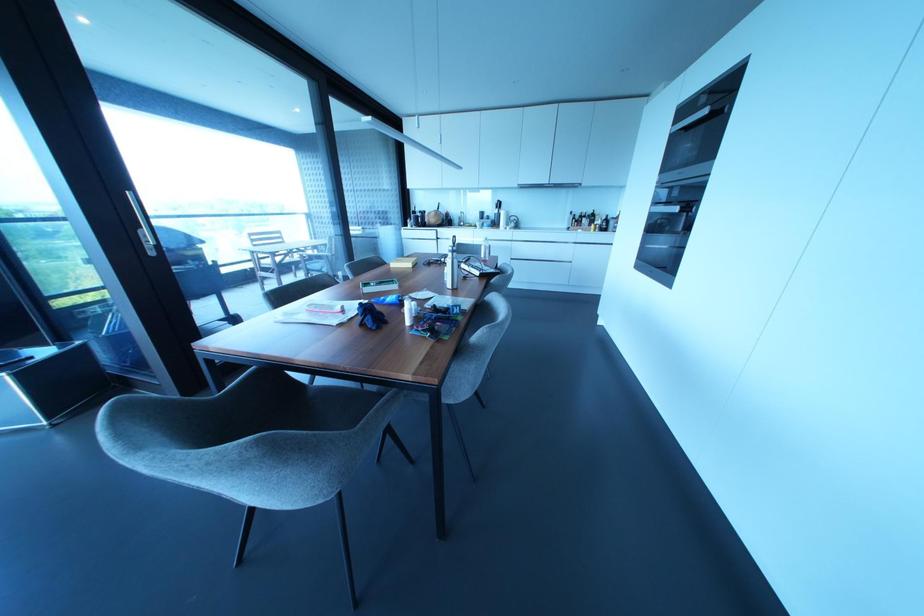
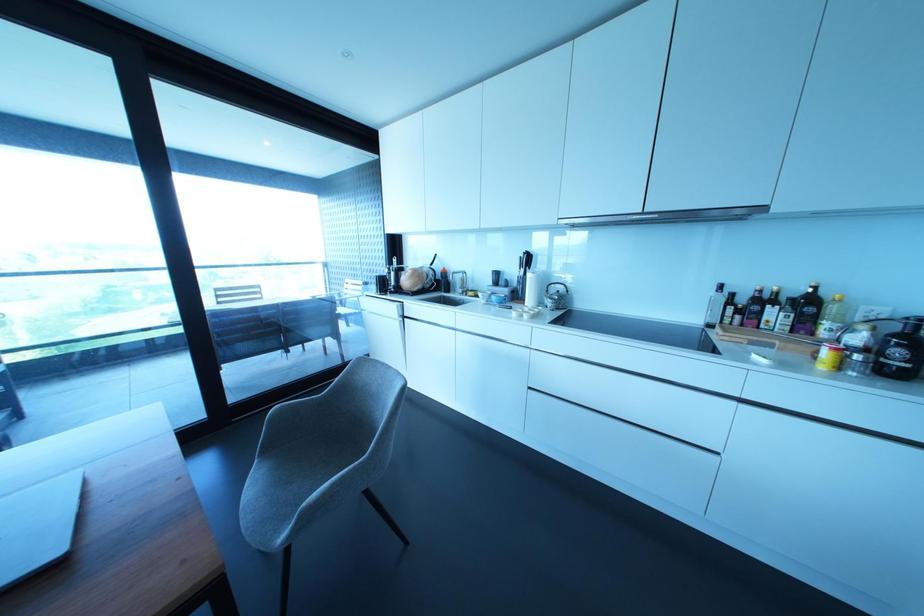
Where in the second image is the point corresponding to pixel 512 224 from the first image?

(549, 302)